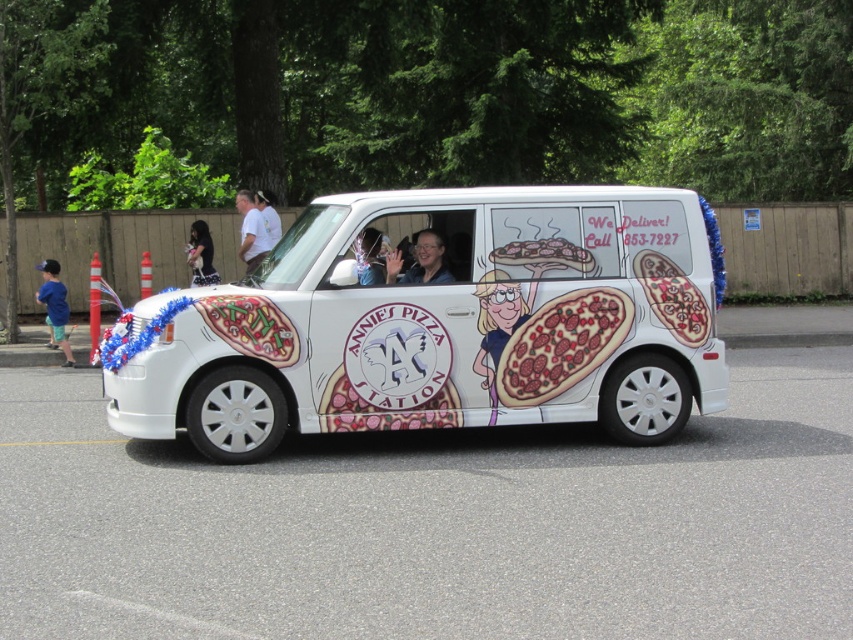
You are a photographer at the event. You need to take a photo of the white glossy van at center from above. Is the matte black camera at center in a good position to capture the van from above?

Yes, the white glossy van at center is positioned under the matte black camera at center, so the matte black camera at center is in a good position to capture the van from above.

You are a photographer taking a picture of the Annie van. You notice two features at the center of the image. Which one is located lower between the matte black glasses at center and the dark hair at center?

The matte black glasses at center is positioned under dark hair at center, so the matte black glasses at center is located lower.

You are a photographer trying to capture the cartoon pizza at center and the dark hair at center in a single photo. Which object should you focus on first to ensure both are in focus?

You should focus on the cartoon pizza at center first because it is closer to the viewer than the dark hair at center, allowing the dark hair at center to fall within the depth of field.